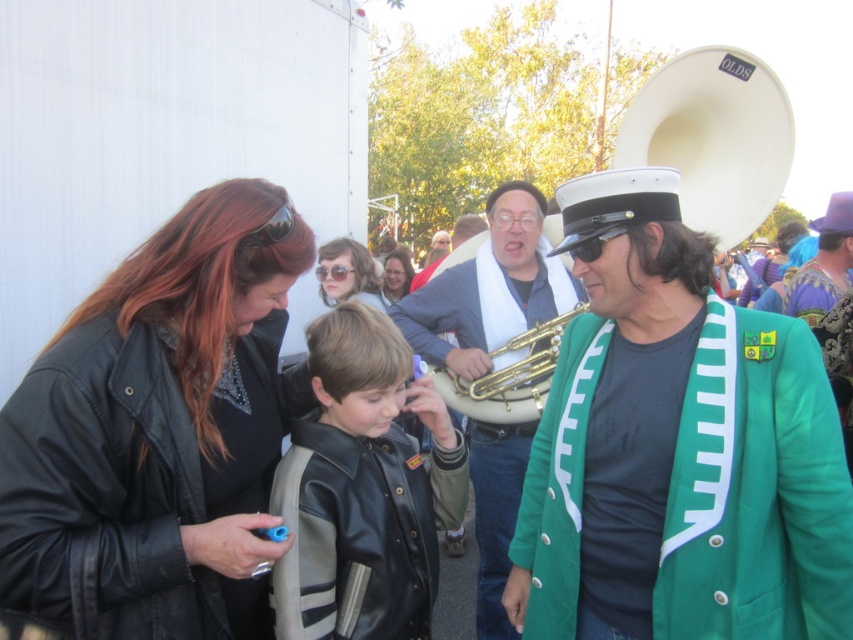
You are a photographer at the event and want to capture a photo where both the green woolen blazer at right and the gold brass trumpet at center are clearly visible. Based on their positions, will the trumpet block the view of the blazer?

The green woolen blazer at right is positioned under the gold brass trumpet at center, so the trumpet will block the view of the blazer if they are in the same plane. To ensure both are visible, adjust the camera angle to capture the blazer below the trumpet or reposition the subjects.

You are a photographer at the event and want to capture a photo that includes both the leather jacket at left and the gold brass trumpet at center. Based on their positions, which object should you place closer to the left edge of your camera frame?

The leather jacket at left should be placed closer to the left edge of your camera frame since it is positioned to the left of the gold brass trumpet at center.